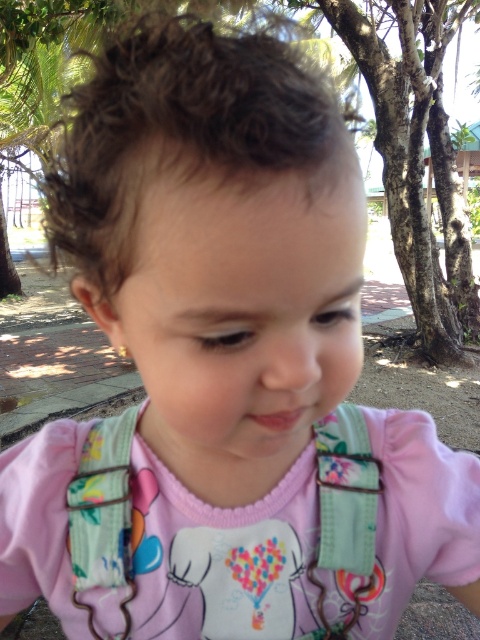
Does floral fabric bib at center have a greater height compared to smooth skin face at center?

Incorrect, floral fabric bib at center's height is not larger of smooth skin face at center's.

Which is above, floral fabric bib at center or smooth skin face at center?

smooth skin face at center

Which is in front, point (9, 522) or point (231, 186)?

Point (231, 186) is in front.

This screenshot has height=640, width=480. Identify the location of floral fabric bib at center. (222, 557).